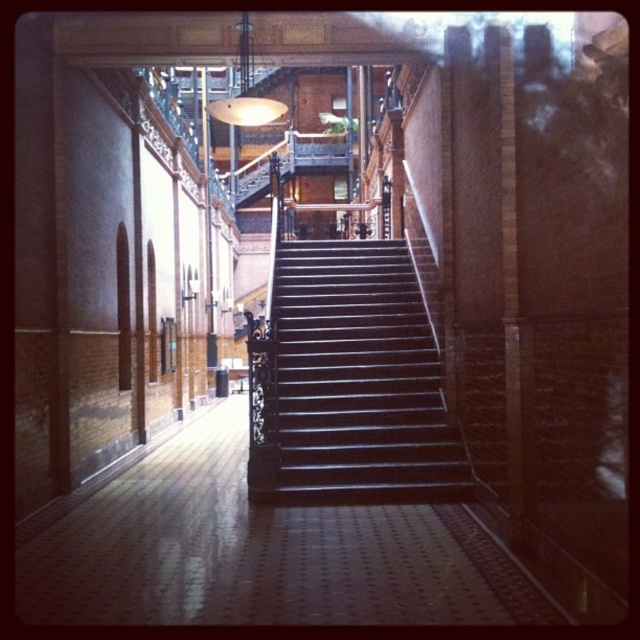
Is brown polished wood floor at center thinner than shiny dark wood stairs at center?

Incorrect, brown polished wood floor at center's width is not less than shiny dark wood stairs at center's.

Is brown polished wood floor at center positioned at the back of shiny dark wood stairs at center?

No, brown polished wood floor at center is closer to the viewer.

Is point (38, 618) more distant than point (380, 378)?

No.

Locate an element on the screen. Image resolution: width=640 pixels, height=640 pixels. brown polished wood floor at center is located at coordinates (256, 550).